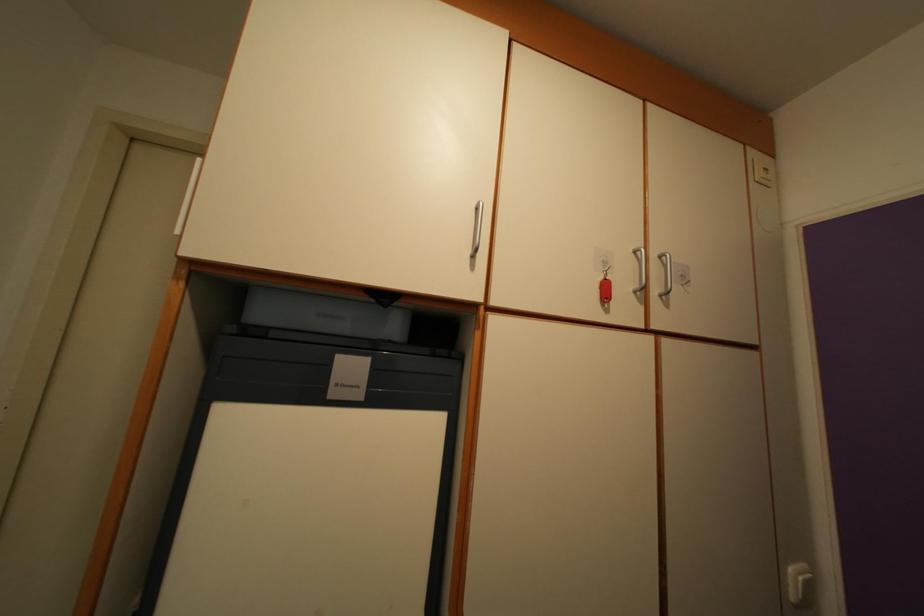
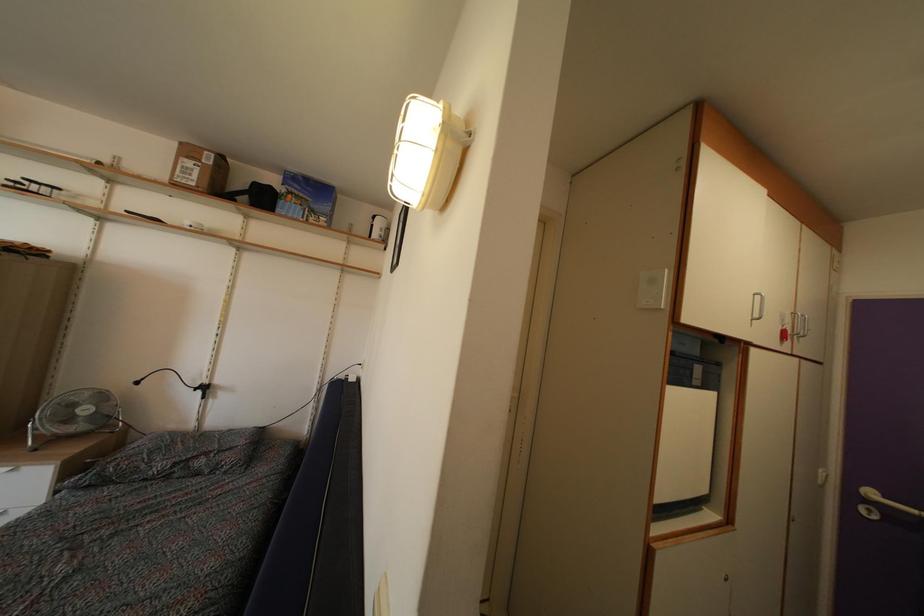
Question: The images are taken continuously from a first-person perspective. In which direction are you moving?

Choices:
 (A) Left
 (B) Right
 (C) Forward
 (D) Backward

Answer: (A)